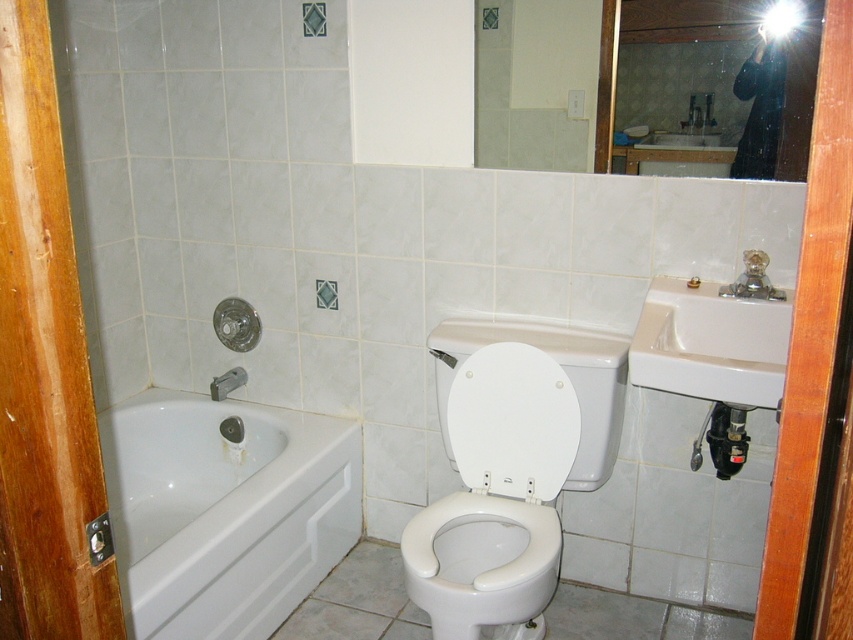
Can you confirm if white plastic toilet seat at center is positioned above matte silver showerhead at lower left?

Incorrect, white plastic toilet seat at center is not positioned above matte silver showerhead at lower left.

Which is behind, point (608, 401) or point (219, 374)?

The point (219, 374) is more distant.

You are a GUI agent. You are given a task and a screenshot of the screen. Output one action in this format:
    pyautogui.click(x=<x>, y=<y>)
    Task: Click on the white plastic toilet seat at center
    
    Given the screenshot: What is the action you would take?
    pyautogui.click(x=566, y=372)

Who is positioned more to the left, white glossy toilet at center or white ceramic sink at right?

From the viewer's perspective, white glossy toilet at center appears more on the left side.

Does white glossy toilet at center have a greater width compared to white ceramic sink at right?

Yes.

Describe the element at coordinates (509, 468) in the screenshot. I see `white glossy toilet at center` at that location.

The image size is (853, 640). Identify the location of white glossy toilet at center. (509, 468).

Between white glossy bathtub at lower left and white glossy toilet bowl at center, which one has more height?

white glossy bathtub at lower left is taller.

Can you confirm if white glossy bathtub at lower left is wider than white glossy toilet bowl at center?

Yes, white glossy bathtub at lower left is wider than white glossy toilet bowl at center.

Identify the location of white glossy bathtub at lower left. (x=225, y=509).

Identify the location of white glossy bathtub at lower left. (225, 509).